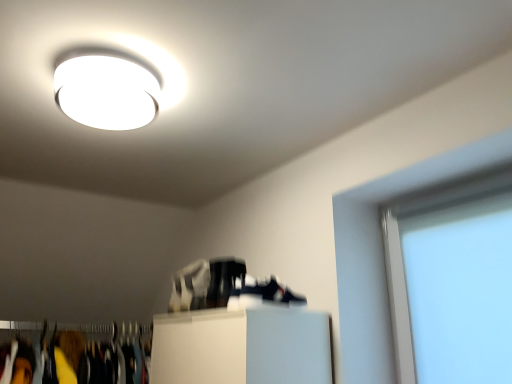
Question: Considering the positions of point (206, 279) and point (211, 286), is point (206, 279) closer or farther from the camera than point (211, 286)?

Choices:
 (A) closer
 (B) farther

Answer: (B)

Question: Based on their positions, is white matte shoe at center, acting as the first shoe starting from the left, located to the left or right of shiny black shoe at center, arranged as the second shoe when viewed from the left?

Choices:
 (A) left
 (B) right

Answer: (A)

Question: Considering the real-world distances, which object is closest to the shiny black shoe at center, which is the second shoe from back to front?

Choices:
 (A) white glossy ceiling light at upper center
 (B) transparent glass window screen at right
 (C) white matte shoe at center, the 1th shoe when ordered from back to front

Answer: (C)

Question: Estimate the real-world distances between objects in this image. Which object is farther from the white glossy ceiling light at upper center?

Choices:
 (A) transparent glass window screen at right
 (B) shiny black shoe at center, the 1th shoe in the front-to-back sequence
 (C) white matte shoe at center, the 2th shoe positioned from the front

Answer: (A)